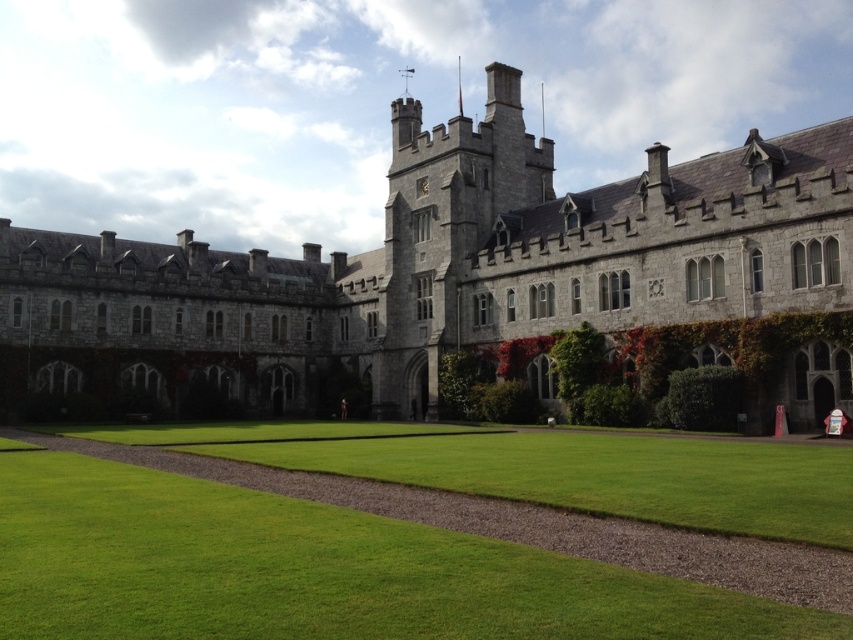
Question: Which point is farther from the camera taking this photo?

Choices:
 (A) (541, 630)
 (B) (741, 209)

Answer: (B)

Question: Does gray stone castle at center appear on the right side of green grass at center?

Choices:
 (A) yes
 (B) no

Answer: (A)

Question: Considering the relative positions of gray stone castle at center and green grass at center in the image provided, where is gray stone castle at center located with respect to green grass at center?

Choices:
 (A) left
 (B) right

Answer: (B)

Question: Which object appears farthest from the camera in this image?

Choices:
 (A) gray stone castle at center
 (B) green grass at center

Answer: (A)

Question: Can you confirm if gray stone castle at center is wider than green grass at center?

Choices:
 (A) no
 (B) yes

Answer: (B)